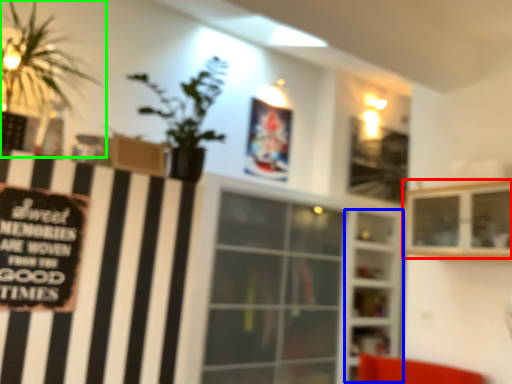
Question: Which object is the farthest from shelf (highlighted by a red box)? Choose among these: shelf (highlighted by a blue box) or houseplant (highlighted by a green box).

Choices:
 (A) shelf
 (B) houseplant

Answer: (A)